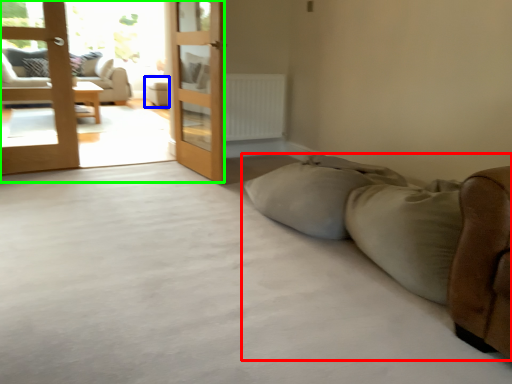
Question: Which object is the closest to the studio couch (highlighted by a red box)? Choose among these: furniture (highlighted by a blue box) or terrace (highlighted by a green box).

Choices:
 (A) furniture
 (B) terrace

Answer: (B)